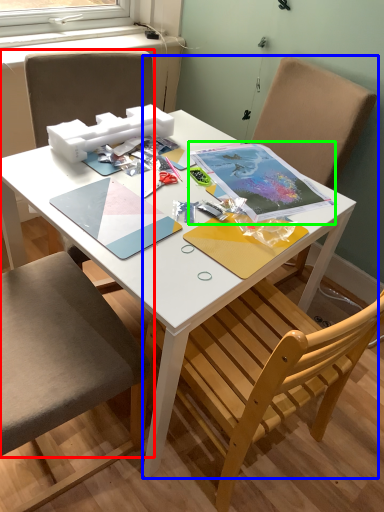
Question: Considering the real-world distances, which object is farthest from chair (highlighted by a red box)? chair (highlighted by a blue box) or notebook (highlighted by a green box)?

Choices:
 (A) chair
 (B) notebook

Answer: (A)